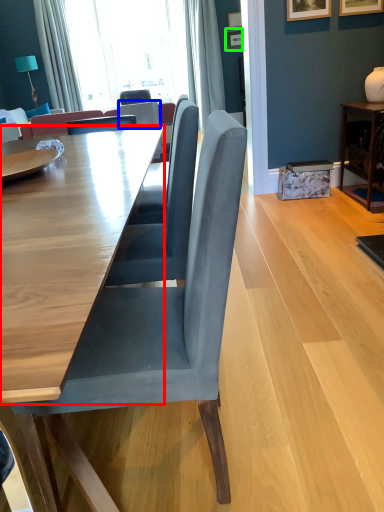
Question: Considering the real-world distances, which object is farthest from table (highlighted by a red box)? chair (highlighted by a blue box) or picture frame (highlighted by a green box)?

Choices:
 (A) chair
 (B) picture frame

Answer: (B)